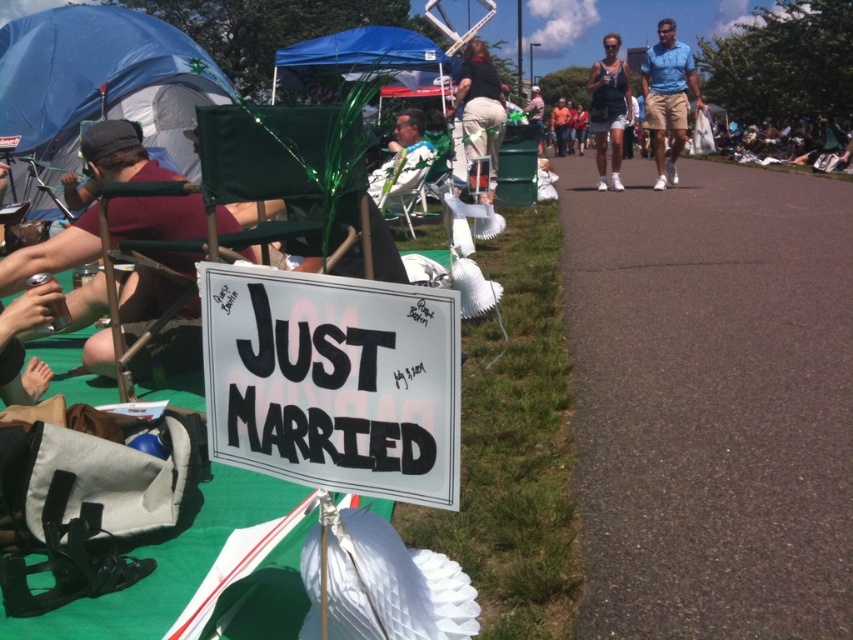
You are a photographer at the event and want to capture a photo that includes both the blue cotton shirt at upper right and the matte green chair at center. Which object should you position closer to the camera to ensure both are in focus?

To ensure both the blue cotton shirt at upper right and the matte green chair at center are in focus, position the matte green chair at center closer to the camera since it is behind the blue cotton shirt at upper right.

You are planning to set up a temporary shade area for an event. You have a blue fabric canopy at upper center and denim shorts at center available. Which object would be more suitable for providing shade to a group of people?

The blue fabric canopy at upper center is larger in size than the denim shorts at center, making it more suitable for providing shade to a group of people.

You are standing at the point with coordinates (x=369, y=58) in the image. What object is located exactly at that point?

The blue fabric canopy at upper center is located exactly at point (x=369, y=58).